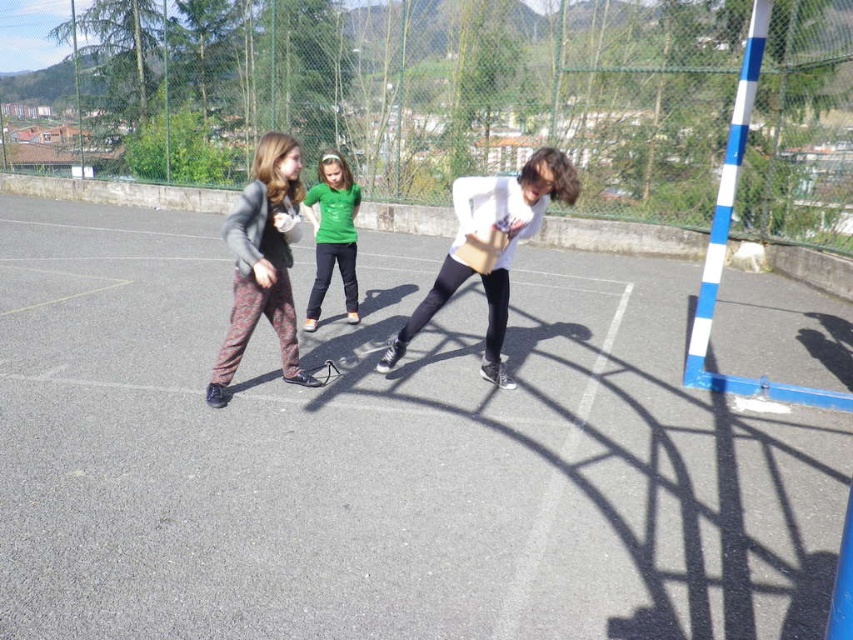
In the scene shown: You are standing at the edge of the basketball court and want to pick up two items located at point 1 and point 2. Point 1 is at coordinates point (137, 554) and point 2 is at point (494, 301). Which point should you go to first to reach the closer item?

Point 1 at coordinates point (137, 554) is closer to the camera, so you should go to point 1 first to reach the closer item.

Looking at this image, you are a photographer standing behind the blue and white striped pole on the court. You want to take a photo of the white matte shirt at center and the patterned fabric pants at center. Which object will appear closer to you in the photo?

The white matte shirt at center will appear closer to you in the photo because it is further to the viewer than the patterned fabric pants at center.

From the picture: You are standing on the basketball court and see two points marked on the ground. The first point is at coordinates point (251, 272) and the second point is at point (349, 204). If you want to reach the point that is closer to you first, which coordinate should you head towards?

You should head towards point (251, 272) because it is closer to the viewer than point (349, 204).